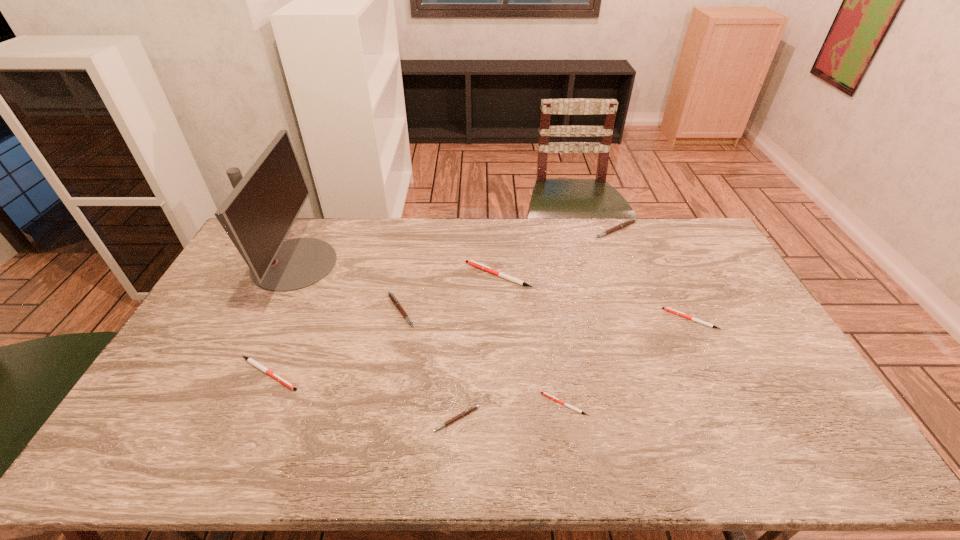
Identify the location of gray computer monitor. (258, 214).

Find the location of a particular element. computer monitor is located at coordinates coord(258,214).

Locate an element on the screen. the farthest pink pen is located at coordinates (631, 221).

You are a GUI agent. You are given a task and a screenshot of the screen. Output one action in this format:
    pyautogui.click(x=<x>, y=<y>)
    Task: Click on the farthest pen
    The image size is (960, 540).
    Given the screenshot: What is the action you would take?
    pyautogui.click(x=631, y=221)

Find the location of a particular element. The width and height of the screenshot is (960, 540). the second farthest pen is located at coordinates (470, 262).

Identify the location of the biggest white pen. (470, 262).

This screenshot has height=540, width=960. I want to click on the sixth pen from right to left, so click(393, 298).

Locate an element on the screen. the third object from left to right is located at coordinates (393, 298).

Find the location of a particular element. the third farthest white pen is located at coordinates (250, 360).

At what (x,y) coordinates should I click in order to perform the action: click on the sixth farthest object. Please return your answer as a coordinate pair (x, y). This screenshot has height=540, width=960. Looking at the image, I should click on (250, 360).